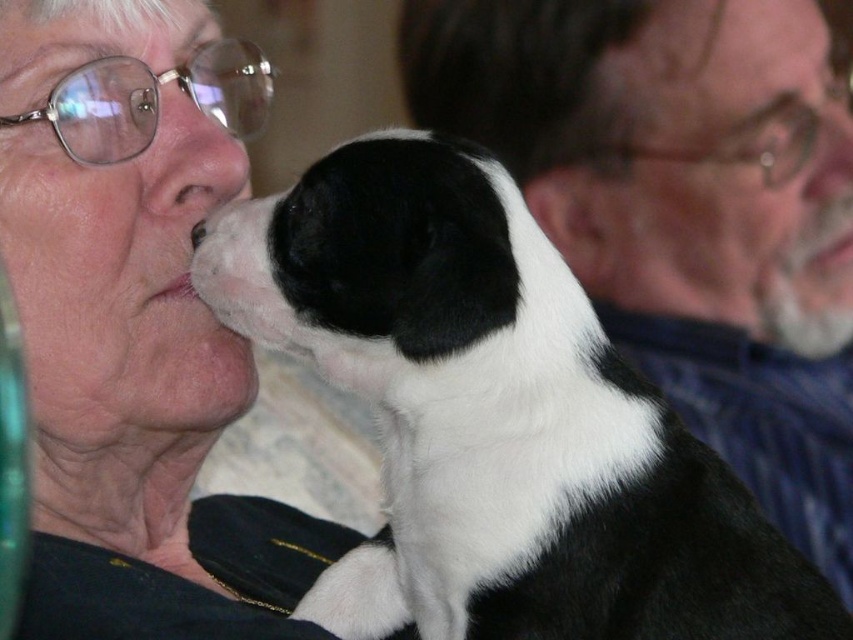
You are standing in front of a painting that depicts an elderly woman interacting with a small black and white puppy. The painting has a blurred background with another person in the background. The black and white fur at center is part of the puppy. If you want to estimate how far the puppy is from you, what measurement would help you determine this?

The distance between the black and white fur at center and the viewer is 29.19 inches, so the puppy is approximately 29.19 inches away from you.

You are a photographer holding a camera. You want to take a picture of the elderly woman and the puppy without moving the camera. Can you adjust your position so that the matte black jacket at upper left is not in the frame?

The matte black jacket at upper left and camera are 30.20 inches apart. Since the jacket is at the upper left corner of the frame, you can move the camera slightly to the right or zoom in to exclude the matte black jacket at upper left from the photo.